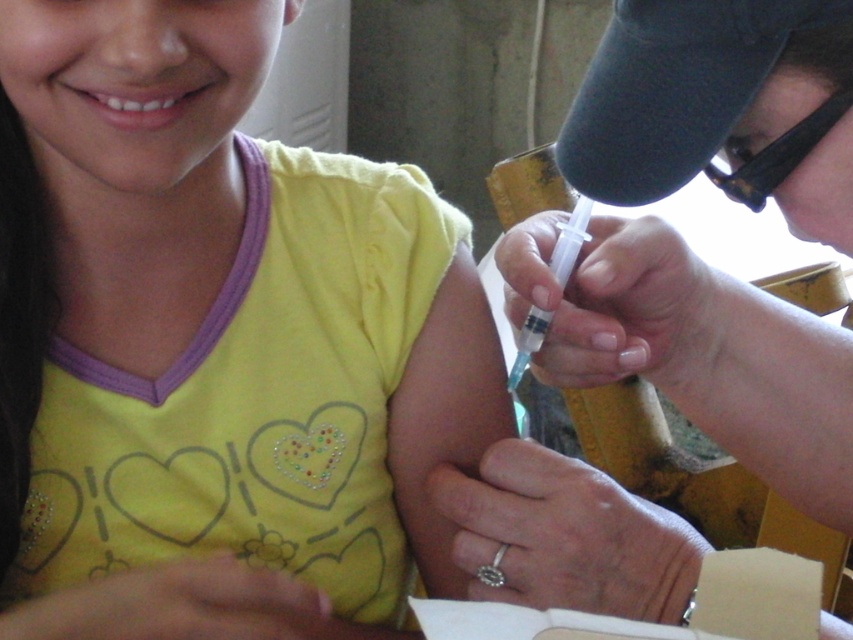
Where is `yellow matte shirt at upper center`? The image size is (853, 640). yellow matte shirt at upper center is located at coordinates pyautogui.click(x=216, y=342).

I want to click on yellow matte shirt at upper center, so pyautogui.click(x=216, y=342).

Consider the image. Is yellow matte shirt at upper center taller than black plastic goggles at upper right?

Indeed, yellow matte shirt at upper center has a greater height compared to black plastic goggles at upper right.

Where is `yellow matte shirt at upper center`? yellow matte shirt at upper center is located at coordinates (216, 342).

I want to click on yellow matte shirt at upper center, so click(216, 342).

Can you confirm if matte plastic syringe at upper right is wider than black plastic goggles at upper right?

Correct, the width of matte plastic syringe at upper right exceeds that of black plastic goggles at upper right.

Is matte plastic syringe at upper right to the right of black plastic goggles at upper right from the viewer's perspective?

No, matte plastic syringe at upper right is not to the right of black plastic goggles at upper right.

Find the location of a particular element. matte plastic syringe at upper right is located at coordinates (695, 349).

The height and width of the screenshot is (640, 853). I want to click on matte plastic syringe at upper right, so click(x=695, y=349).